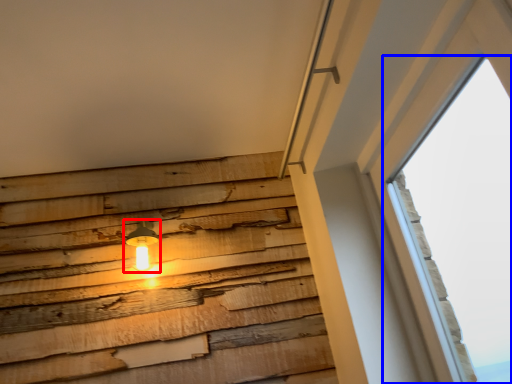
Question: Which object appears closest to the camera in this image, lamp (highlighted by a red box) or window (highlighted by a blue box)?

Choices:
 (A) lamp
 (B) window

Answer: (B)